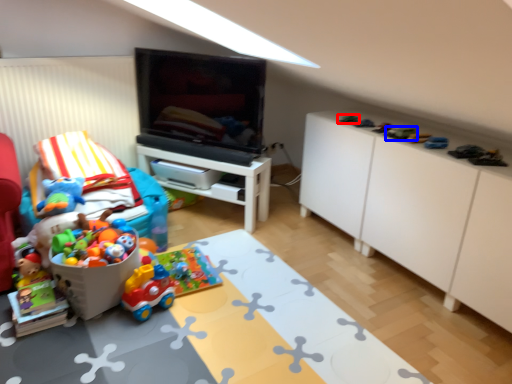
Question: Which object is closer to the camera taking this photo, toy (highlighted by a red box) or toy (highlighted by a blue box)?

Choices:
 (A) toy
 (B) toy

Answer: (B)